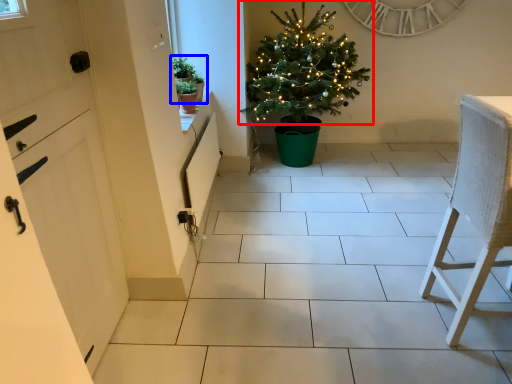
Question: Which point is further to the camera, christmas tree (highlighted by a red box) or houseplant (highlighted by a blue box)?

Choices:
 (A) christmas tree
 (B) houseplant

Answer: (A)